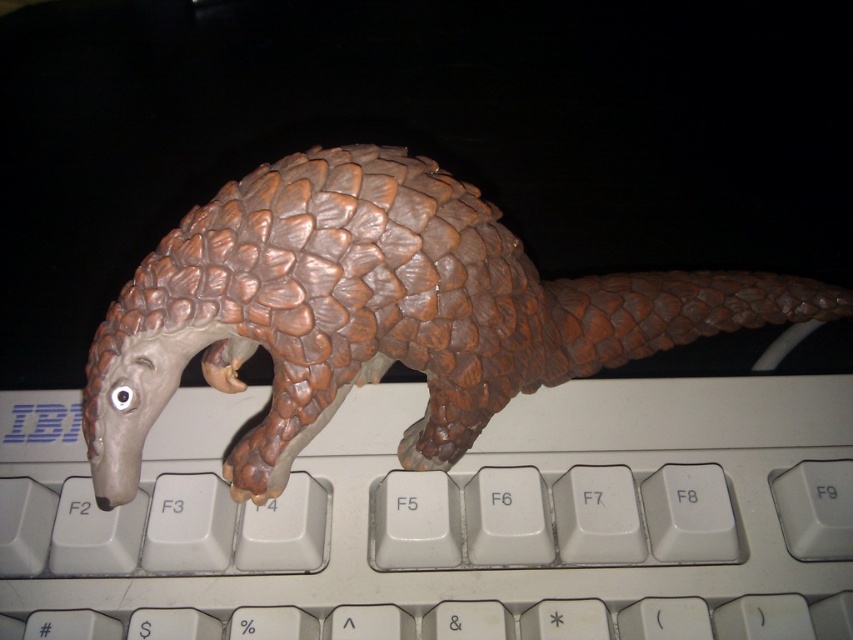
Between white plastic keyboard at center and brown scaly pangolin at center, which one has less height?

Standing shorter between the two is white plastic keyboard at center.

Can you confirm if white plastic keyboard at center is positioned to the left of brown scaly pangolin at center?

Yes, white plastic keyboard at center is to the left of brown scaly pangolin at center.

Locate an element on the screen. This screenshot has height=640, width=853. white plastic keyboard at center is located at coordinates (448, 520).